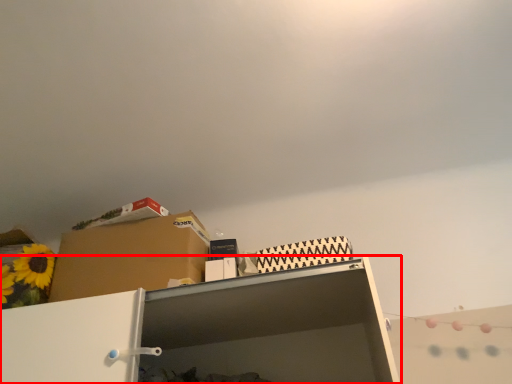
Question: From the image's perspective, where is shelf (annotated by the red box) located in relation to cardboard box in the image?

Choices:
 (A) below
 (B) above

Answer: (A)